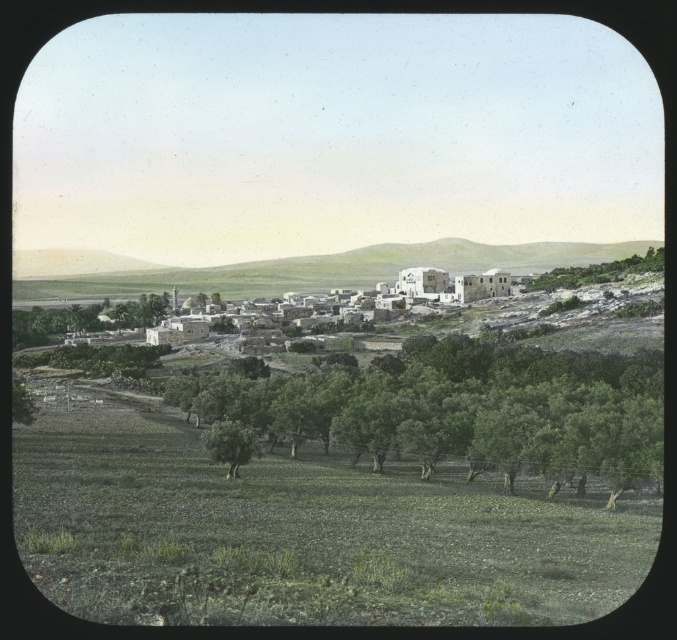
Question: Does green leafy tree at center appear under green leafy olive tree at center?

Choices:
 (A) yes
 (B) no

Answer: (B)

Question: Which point is farther from the camera taking this photo?

Choices:
 (A) (349, 412)
 (B) (504, 282)
 (C) (148, 285)

Answer: (C)

Question: Considering the real-world distances, which object is closest to the green leafy tree at center?

Choices:
 (A) white stone window at center
 (B) white stucco buildings at center

Answer: (A)

Question: Among these points, which one is nearest to the camera?

Choices:
 (A) (261, 404)
 (B) (498, 280)

Answer: (A)

Question: Is white stucco buildings at center positioned behind green leafy olive tree at center?

Choices:
 (A) no
 (B) yes

Answer: (B)

Question: Can you confirm if white stucco buildings at center is bigger than green leafy olive tree at center?

Choices:
 (A) yes
 (B) no

Answer: (A)